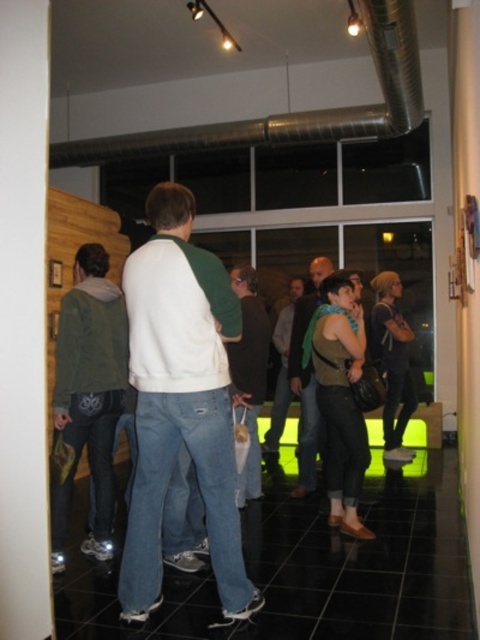
Question: Which point is closer to the camera taking this photo?

Choices:
 (A) (128, 621)
 (B) (302, 490)

Answer: (A)

Question: Is white cotton sweater at center positioned in front of green scarf at center?

Choices:
 (A) yes
 (B) no

Answer: (A)

Question: Is white cotton sweater at center above green scarf at center?

Choices:
 (A) no
 (B) yes

Answer: (B)

Question: Which point appears farthest from the camera in this image?

Choices:
 (A) (192, 218)
 (B) (297, 497)

Answer: (B)

Question: Does white cotton sweater at center have a greater width compared to green scarf at center?

Choices:
 (A) no
 (B) yes

Answer: (B)